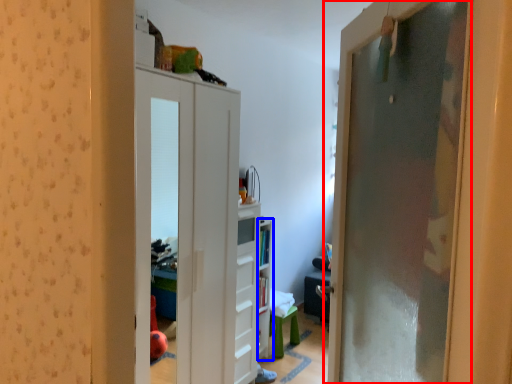
Question: Which point is closer to the camera, door (highlighted by a red box) or shelf (highlighted by a blue box)?

Choices:
 (A) door
 (B) shelf

Answer: (A)